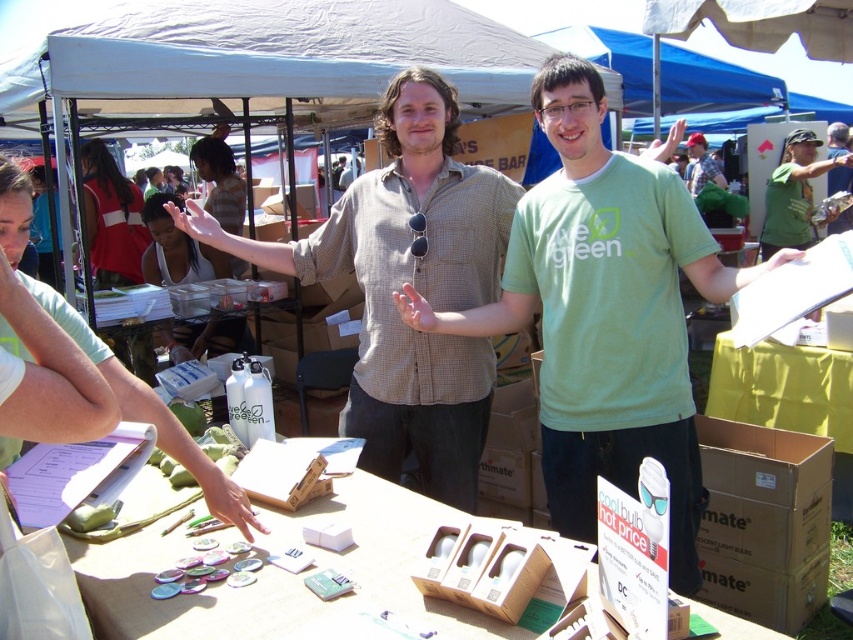
Question: Among these points, which one is nearest to the camera?

Choices:
 (A) (218, 273)
 (B) (726, 531)
 (C) (807, 424)
 (D) (718, 184)

Answer: (B)

Question: Based on their relative distances, which object is nearer to the green matte shirt at center?

Choices:
 (A) green t-shirt at center
 (B) green fabric shirt at center

Answer: (A)

Question: Which point is closer to the camera taking this photo?

Choices:
 (A) (370, 284)
 (B) (157, 188)

Answer: (A)

Question: Where is wooden table at center located in relation to yellow cardboard box at right in the image?

Choices:
 (A) below
 (B) above

Answer: (A)

Question: Can you confirm if red fabric dress at upper left is positioned above green fabric shirt at upper right?

Choices:
 (A) no
 (B) yes

Answer: (A)

Question: Does brown cardboard box at lower right have a lesser width compared to red fabric dress at upper left?

Choices:
 (A) yes
 (B) no

Answer: (A)